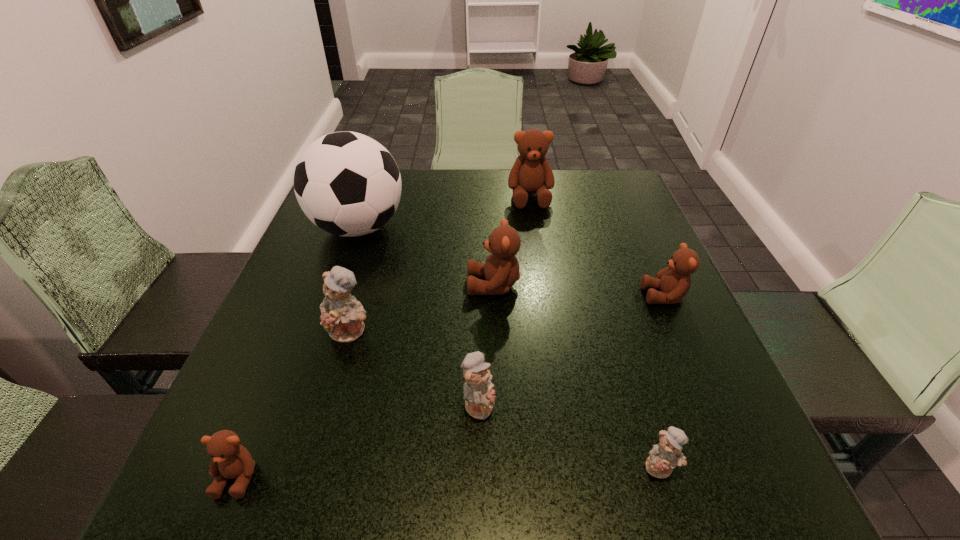
The image size is (960, 540). What are the coordinates of `the tallest object` in the screenshot? It's located at (347, 184).

Where is `soccer ball`? soccer ball is located at coordinates (347, 184).

Find the location of a particular element. The width and height of the screenshot is (960, 540). the biggest brown teddy bear is located at coordinates (531, 173).

Where is `the farthest brown teddy bear`? The image size is (960, 540). the farthest brown teddy bear is located at coordinates (531, 173).

Where is `the third smallest brown teddy bear`? Image resolution: width=960 pixels, height=540 pixels. the third smallest brown teddy bear is located at coordinates (501, 269).

The width and height of the screenshot is (960, 540). Identify the location of the second teddy bear from left to right. [342, 316].

In order to click on the leftmost blue teddy bear in this screenshot , I will do `click(342, 316)`.

Locate an element on the screen. the rightmost brown teddy bear is located at coordinates (674, 281).

The width and height of the screenshot is (960, 540). Identify the location of the rightmost teddy bear. (674, 281).

The image size is (960, 540). Find the location of `the second biggest blue teddy bear`. the second biggest blue teddy bear is located at coordinates (479, 396).